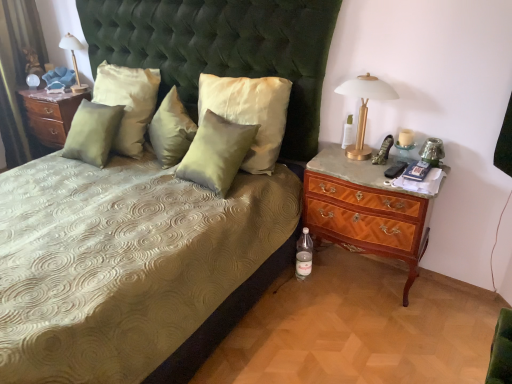
This screenshot has width=512, height=384. In order to click on free space to the left of clear plastic bottle at lower right, the 1th bottle from the bottom in this screenshot , I will do `click(282, 286)`.